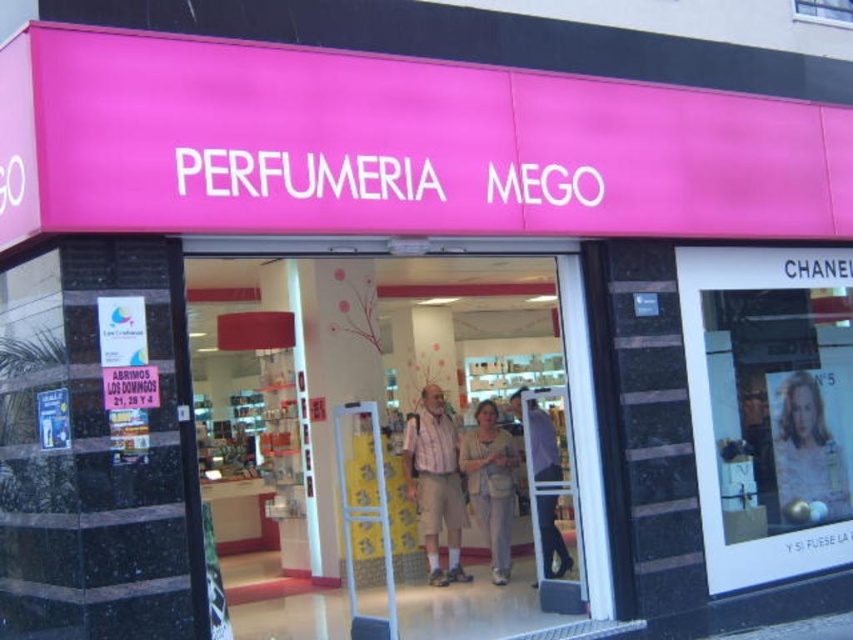
Consider the image. Which of these two, smooth plastic poster at center or plaid shirt at center, stands taller?

With more height is plaid shirt at center.

Can you confirm if smooth plastic poster at center is smaller than plaid shirt at center?

Yes, smooth plastic poster at center is smaller than plaid shirt at center.

Between point (788, 392) and point (422, 499), which one is positioned behind?

The point (422, 499) is more distant.

You are a GUI agent. You are given a task and a screenshot of the screen. Output one action in this format:
    pyautogui.click(x=<x>, y=<y>)
    Task: Click on the smooth plastic poster at center
    The width and height of the screenshot is (853, 640).
    Given the screenshot: What is the action you would take?
    pyautogui.click(x=807, y=449)

Is smooth plastic poster at center above light brown leather jacket at center?

Yes.

Is smooth plastic poster at center thinner than light brown leather jacket at center?

No.

Image resolution: width=853 pixels, height=640 pixels. In order to click on smooth plastic poster at center in this screenshot , I will do (x=807, y=449).

Does smooth plastic poster at center appear on the right side of light beige fabric dress at center?

Indeed, smooth plastic poster at center is positioned on the right side of light beige fabric dress at center.

Which is in front, point (791, 509) or point (486, 458)?

Positioned in front is point (791, 509).

Locate an element on the screen. smooth plastic poster at center is located at coordinates (807, 449).

This screenshot has height=640, width=853. In order to click on smooth plastic poster at center in this screenshot , I will do `click(807, 449)`.